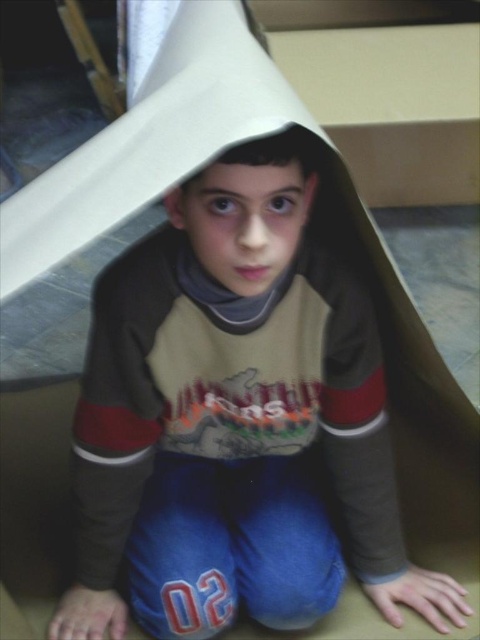
The boy is sitting inside a cardboard box that has a matte brown hoodie at center. He wants to reach the hoodie without moving his arms. Can he do it?

The matte brown hoodie at center is 21.34 inches away from the boy, so he cannot reach it without moving his arms since the distance is too far.

You are organizing a small storage space and need to place the matte brown hoodie at center and the matte brown paper bag at center. Based on their positions, which object is to the right of the other?

The matte brown hoodie at center is positioned on the right side of the matte brown paper bag at center.